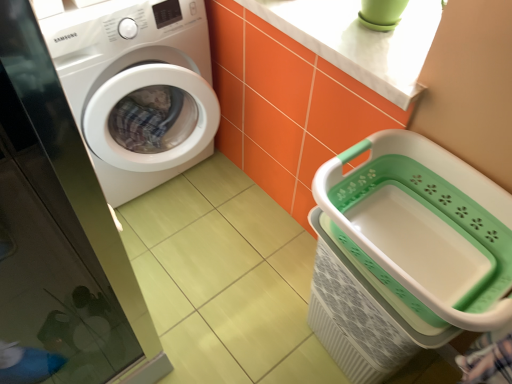
Question: Relative to white glossy washing machine at left, is transparent glass screen door at left in front or behind?

Choices:
 (A) behind
 (B) front

Answer: (B)

Question: Is transparent glass screen door at left inside or outside of white glossy washing machine at left?

Choices:
 (A) outside
 (B) inside

Answer: (A)

Question: Based on their relative distances, which object is farther from the white marble countertop at upper center?

Choices:
 (A) white glossy washing machine at left
 (B) white plastic laundry basket at lower right
 (C) transparent glass screen door at left

Answer: (C)

Question: Which of these objects is positioned farthest from the white glossy washing machine at left?

Choices:
 (A) transparent glass screen door at left
 (B) white marble countertop at upper center
 (C) white plastic laundry basket at lower right

Answer: (C)